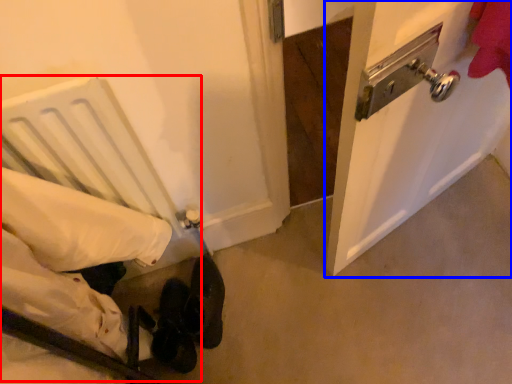
Question: Which of the following is the closest to the observer, bed (highlighted by a red box) or door (highlighted by a blue box)?

Choices:
 (A) bed
 (B) door

Answer: (A)